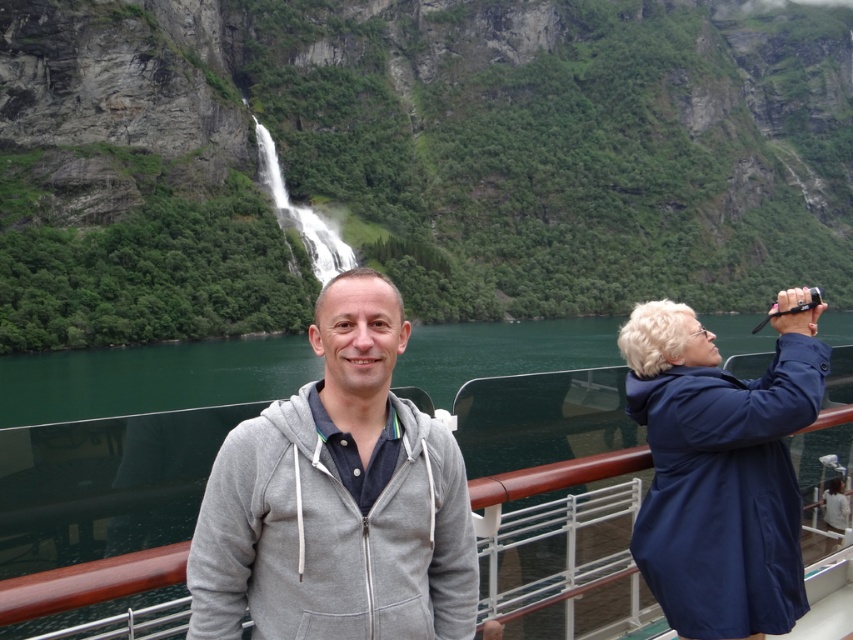
Question: Can you confirm if gray zip-up hoodie at center is thinner than blue matte jacket at upper right?

Choices:
 (A) no
 (B) yes

Answer: (A)

Question: Among these points, which one is nearest to the camera?

Choices:
 (A) (474, 352)
 (B) (325, 412)

Answer: (B)

Question: Which object is positioned farthest from the gray zip-up hoodie at center?

Choices:
 (A) green water at center
 (B) gray fabric boat at center
 (C) blue matte jacket at upper right

Answer: (A)

Question: Which of the following is the farthest from the observer?

Choices:
 (A) (315, 333)
 (B) (509, 358)

Answer: (B)

Question: Can you confirm if gray zip-up hoodie at center is smaller than green water at center?

Choices:
 (A) no
 (B) yes

Answer: (B)

Question: Is gray zip-up hoodie at center further to camera compared to blue matte jacket at upper right?

Choices:
 (A) yes
 (B) no

Answer: (B)